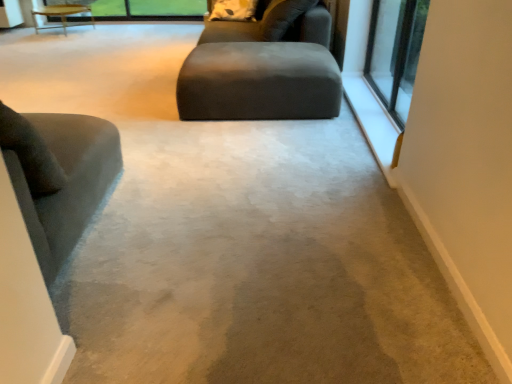
Question: Should I look upward or downward to see matte gray ottoman at center?

Choices:
 (A) down
 (B) up

Answer: (B)

Question: Is white soft pillow at upper center placed right next to velvet gray chair at left?

Choices:
 (A) yes
 (B) no

Answer: (B)

Question: Is white soft pillow at upper center outside of velvet gray chair at left?

Choices:
 (A) yes
 (B) no

Answer: (A)

Question: Can you confirm if white soft pillow at upper center is thinner than velvet gray chair at left?

Choices:
 (A) yes
 (B) no

Answer: (A)

Question: Is white soft pillow at upper center oriented towards velvet gray chair at left?

Choices:
 (A) no
 (B) yes

Answer: (B)

Question: Is white soft pillow at upper center taller than velvet gray chair at left?

Choices:
 (A) no
 (B) yes

Answer: (A)

Question: Considering the relative sizes of white soft pillow at upper center and velvet gray chair at left in the image provided, is white soft pillow at upper center shorter than velvet gray chair at left?

Choices:
 (A) yes
 (B) no

Answer: (A)

Question: Is the depth of matte gray ottoman at center greater than that of white soft pillow at upper center?

Choices:
 (A) yes
 (B) no

Answer: (B)

Question: Is matte gray ottoman at center looking in the opposite direction of white soft pillow at upper center?

Choices:
 (A) no
 (B) yes

Answer: (A)

Question: From a real-world perspective, is matte gray ottoman at center located beneath white soft pillow at upper center?

Choices:
 (A) no
 (B) yes

Answer: (B)

Question: Is matte gray ottoman at center bigger than white soft pillow at upper center?

Choices:
 (A) yes
 (B) no

Answer: (A)

Question: Is matte gray ottoman at center positioned far away from white soft pillow at upper center?

Choices:
 (A) yes
 (B) no

Answer: (A)

Question: Is matte gray ottoman at center aimed at white soft pillow at upper center?

Choices:
 (A) yes
 (B) no

Answer: (B)

Question: Is matte gray ottoman at center facing away from wooden table at upper left?

Choices:
 (A) no
 (B) yes

Answer: (A)